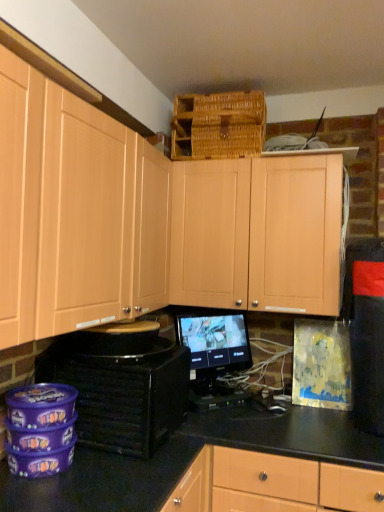
Question: Are matte wood cabinets at upper center, which ranks as the 1th cabinetry in left-to-right order, and black matte speaker at lower left located far from each other?

Choices:
 (A) yes
 (B) no

Answer: (B)

Question: From the image's perspective, is matte wood cabinets at upper center, the second cabinetry in the right-to-left sequence, on black matte speaker at lower left?

Choices:
 (A) no
 (B) yes

Answer: (B)

Question: From the image's perspective, does matte wood cabinets at upper center, the second cabinetry in the right-to-left sequence, appear lower than black matte speaker at lower left?

Choices:
 (A) yes
 (B) no

Answer: (B)

Question: Is matte wood cabinets at upper center, which ranks as the 1th cabinetry in left-to-right order, touching black matte speaker at lower left?

Choices:
 (A) yes
 (B) no

Answer: (B)

Question: Considering the relative sizes of matte wood cabinets at upper center, the second cabinetry in the right-to-left sequence, and black matte speaker at lower left in the image provided, is matte wood cabinets at upper center, the second cabinetry in the right-to-left sequence, bigger than black matte speaker at lower left?

Choices:
 (A) no
 (B) yes

Answer: (B)

Question: From the image's perspective, is black matte speaker at lower left positioned above or below black glossy counter top at center?

Choices:
 (A) above
 (B) below

Answer: (A)

Question: Would you say black matte speaker at lower left is to the left or to the right of black glossy counter top at center in the picture?

Choices:
 (A) left
 (B) right

Answer: (A)

Question: Considering the positions of black matte speaker at lower left and black glossy counter top at center in the image, is black matte speaker at lower left wider or thinner than black glossy counter top at center?

Choices:
 (A) thin
 (B) wide

Answer: (A)

Question: Is black matte speaker at lower left in front of or behind black glossy counter top at center in the image?

Choices:
 (A) behind
 (B) front

Answer: (A)

Question: Visually, is matte wood cabinets at upper center, the second cabinetry in the right-to-left sequence, positioned to the left or to the right of black glossy counter top at center?

Choices:
 (A) left
 (B) right

Answer: (A)

Question: Is matte wood cabinets at upper center, which ranks as the 1th cabinetry in left-to-right order, inside or outside of black glossy counter top at center?

Choices:
 (A) outside
 (B) inside

Answer: (A)

Question: In the image, is matte wood cabinets at upper center, the second cabinetry in the right-to-left sequence, positioned in front of or behind black glossy counter top at center?

Choices:
 (A) behind
 (B) front

Answer: (B)

Question: In terms of height, does matte wood cabinets at upper center, which ranks as the 1th cabinetry in left-to-right order, look taller or shorter compared to black glossy counter top at center?

Choices:
 (A) short
 (B) tall

Answer: (B)

Question: From the image's perspective, is woven brown basket at upper center positioned above or below matte wood cabinets at upper center, the second cabinetry in the right-to-left sequence?

Choices:
 (A) above
 (B) below

Answer: (A)

Question: In the image, is woven brown basket at upper center positioned in front of or behind matte wood cabinets at upper center, the second cabinetry in the right-to-left sequence?

Choices:
 (A) behind
 (B) front

Answer: (A)